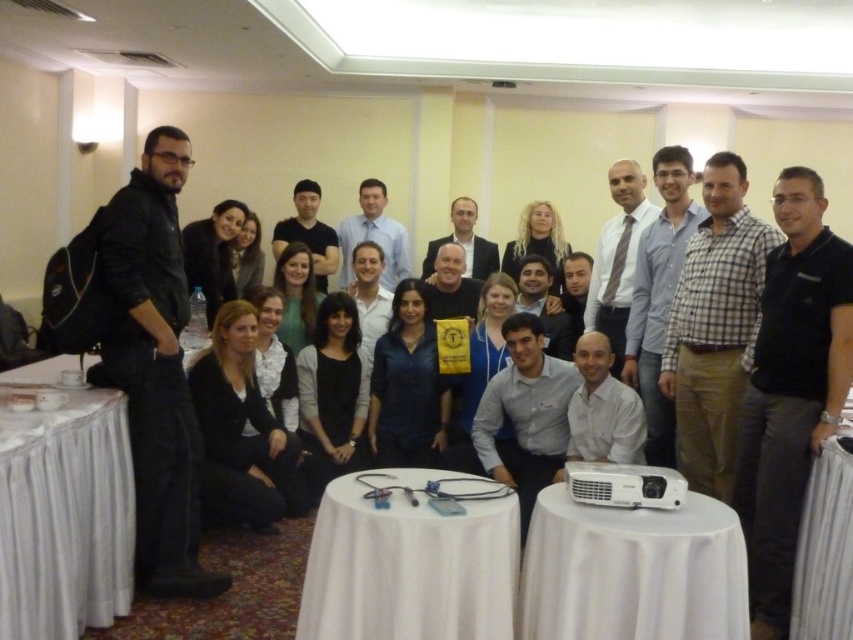
You are organizing a presentation and need to set up the white clothed projector at center. You have a black leather jacket at left that you want to place on the table next to the projector. The table can only accommodate items within 5 feet of the projector. Can you place the jacket there?

The black leather jacket at left and white clothed projector at center are 5.13 feet apart, which is slightly more than the 5 feet limit. Therefore, the jacket cannot be placed on the table next to the projector as it exceeds the required distance.